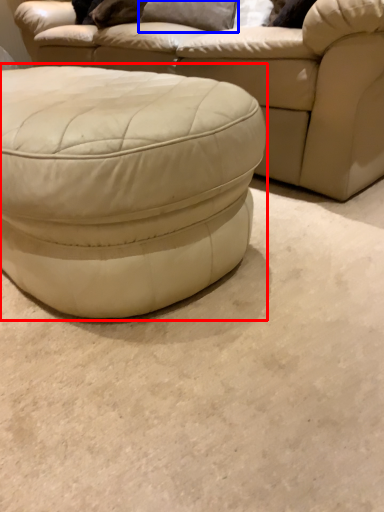
Question: Which object appears farthest to the camera in this image, stool (highlighted by a red box) or pillow (highlighted by a blue box)?

Choices:
 (A) stool
 (B) pillow

Answer: (B)